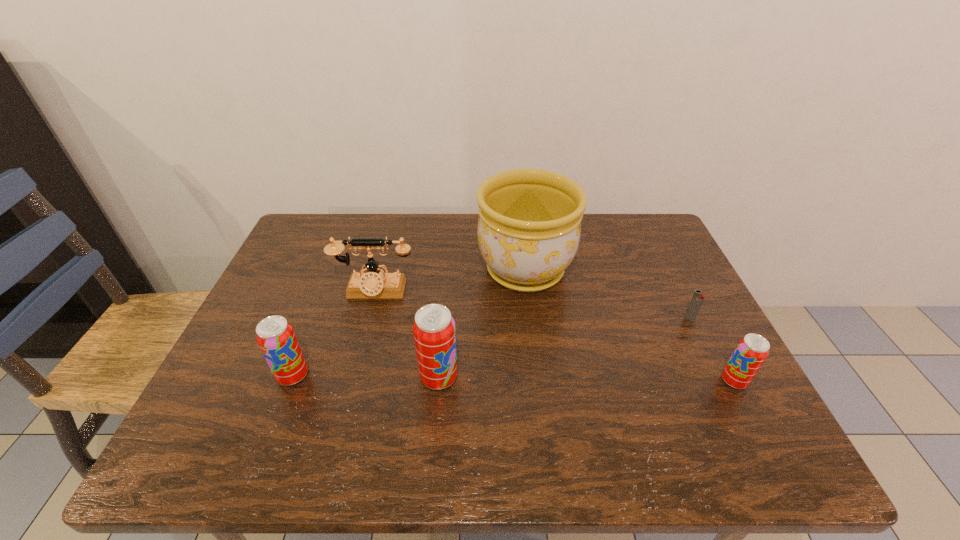
If equal spacing is the goal by inserting an additional pop_(soda) among them, please point out a vacant space for this new pop_(soda). Please provide its 2D coordinates. Your answer should be formatted as a tuple, i.e. [(x, y)], where the tuple contains the x and y coordinates of a point satisfying the conditions above.

[(586, 379)]